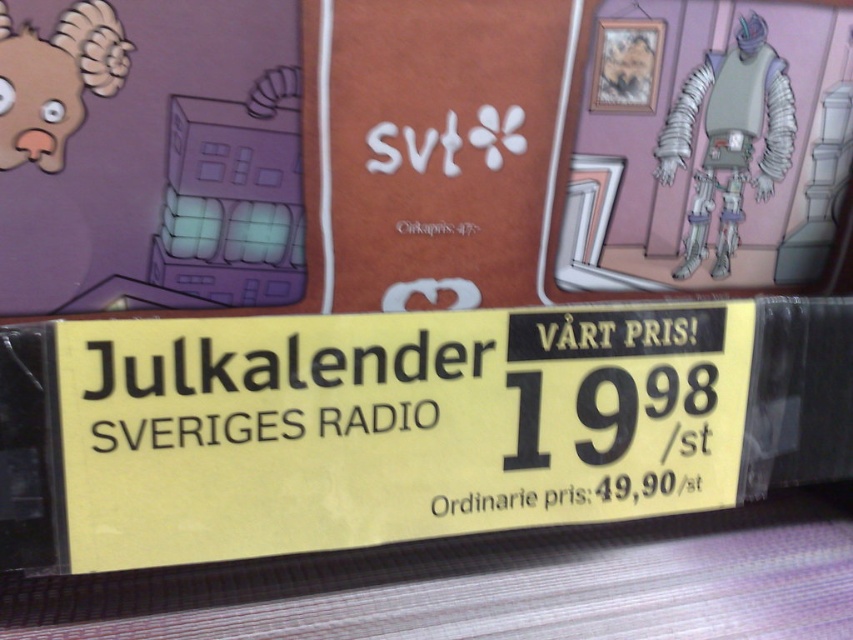
Question: Considering the relative positions of yellow paper sign at center and gray metallic robot at upper right in the image provided, where is yellow paper sign at center located with respect to gray metallic robot at upper right?

Choices:
 (A) below
 (B) above

Answer: (A)

Question: Which of the following is the farthest from the observer?

Choices:
 (A) brown matte animal head at upper left
 (B) gray metallic robot at upper right
 (C) yellow paper sign at center

Answer: (B)

Question: Does yellow paper sign at center lie behind brown matte animal head at upper left?

Choices:
 (A) yes
 (B) no

Answer: (B)

Question: Can you confirm if yellow paper sign at center is wider than brown matte animal head at upper left?

Choices:
 (A) yes
 (B) no

Answer: (A)

Question: Based on their relative distances, which object is farther from the gray metallic robot at upper right?

Choices:
 (A) yellow paper sign at center
 (B) brown matte animal head at upper left

Answer: (B)

Question: Among these points, which one is nearest to the camera?

Choices:
 (A) click(682, 344)
 (B) click(721, 195)

Answer: (A)